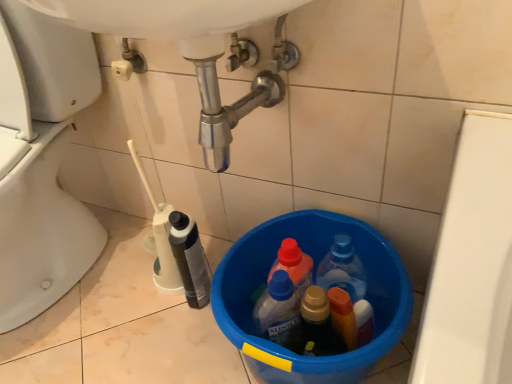
Image resolution: width=512 pixels, height=384 pixels. What do you see at coordinates (189, 259) in the screenshot?
I see `white plastic bottle at lower left` at bounding box center [189, 259].

This screenshot has height=384, width=512. Identify the location of white plastic bottle at lower left. (189, 259).

Between blue plastic bucket at lower center and white glossy toilet at lower left, which one is positioned behind?

Positioned behind is blue plastic bucket at lower center.

Which object is positioned more to the left, blue plastic bucket at lower center or white glossy toilet at lower left?

From the viewer's perspective, white glossy toilet at lower left appears more on the left side.

Is blue plastic bucket at lower center positioned with its back to white glossy toilet at lower left?

No.

Is blue plastic bucket at lower center next to white glossy toilet at lower left and touching it?

No, blue plastic bucket at lower center is not making contact with white glossy toilet at lower left.

From the image's perspective, which is below, white glossy toilet at lower left or white plastic bottle at lower left?

white plastic bottle at lower left appears lower in the image.

Which of these two, white glossy toilet at lower left or white plastic bottle at lower left, is smaller?

Smaller between the two is white plastic bottle at lower left.

Is white glossy toilet at lower left directly adjacent to white plastic bottle at lower left?

No, white glossy toilet at lower left is not with white plastic bottle at lower left.

From a real-world perspective, is white glossy toilet at lower left under white plastic bottle at lower left?

No, from a real-world perspective, white glossy toilet at lower left is not under white plastic bottle at lower left.

From their relative heights in the image, would you say white plastic bottle at lower left is taller or shorter than white glossy toilet at lower left?

Considering their sizes, white plastic bottle at lower left has less height than white glossy toilet at lower left.

In the scene shown: Is white plastic bottle at lower left outside of white glossy toilet at lower left?

That's correct, white plastic bottle at lower left is outside of white glossy toilet at lower left.

From a real-world perspective, does white plastic bottle at lower left stand above white glossy toilet at lower left?

No.

Which object is wider, blue plastic bucket at lower center or white plastic bottle at lower left?

Wider between the two is blue plastic bucket at lower center.

Is the position of blue plastic bucket at lower center less distant than that of white plastic bottle at lower left?

Yes, blue plastic bucket at lower center is in front of white plastic bottle at lower left.

Is blue plastic bucket at lower center taller than white plastic bottle at lower left?

No, blue plastic bucket at lower center is not taller than white plastic bottle at lower left.

Is blue plastic bucket at lower center positioned with its back to white plastic bottle at lower left?

blue plastic bucket at lower center does not have its back to white plastic bottle at lower left.

Considering the relative sizes of white glossy toilet at lower left and blue plastic bucket at lower center in the image provided, is white glossy toilet at lower left smaller than blue plastic bucket at lower center?

Incorrect, white glossy toilet at lower left is not smaller in size than blue plastic bucket at lower center.

How many degrees apart are the facing directions of white glossy toilet at lower left and blue plastic bucket at lower center?

white glossy toilet at lower left and blue plastic bucket at lower center are facing 0.00151 degrees away from each other.

From the image's perspective, is white glossy toilet at lower left over blue plastic bucket at lower center?

Yes, from the image's perspective, white glossy toilet at lower left is on top of blue plastic bucket at lower center.

Is white glossy toilet at lower left oriented away from blue plastic bucket at lower center?

white glossy toilet at lower left does not have its back to blue plastic bucket at lower center.

Is white plastic bottle at lower left turned away from blue plastic bucket at lower center?

No.

Who is taller, white plastic bottle at lower left or blue plastic bucket at lower center?

With more height is white plastic bottle at lower left.

Which is correct: white plastic bottle at lower left is inside blue plastic bucket at lower center, or outside of it?

white plastic bottle at lower left is located beyond the bounds of blue plastic bucket at lower center.

I want to click on toilet above the blue plastic bucket at lower center (from a real-world perspective), so click(41, 161).

This screenshot has height=384, width=512. I want to click on bottle below the white glossy toilet at lower left (from the image's perspective), so click(x=189, y=259).

From the image, which object appears to be farther from white glossy toilet at lower left, white plastic bottle at lower left or blue plastic bucket at lower center?

Among the two, blue plastic bucket at lower center is located further to white glossy toilet at lower left.

When comparing their distances from blue plastic bucket at lower center, does white glossy toilet at lower left or white plastic bottle at lower left seem further?

white glossy toilet at lower left lies further to blue plastic bucket at lower center than the other object.

Estimate the real-world distances between objects in this image. Which object is further from blue plastic bucket at lower center, white plastic bottle at lower left or white glossy toilet at lower left?

white glossy toilet at lower left lies further to blue plastic bucket at lower center than the other object.

Estimate the real-world distances between objects in this image. Which object is further from white glossy toilet at lower left, blue plastic bucket at lower center or white plastic bottle at lower left?

blue plastic bucket at lower center is positioned further to the anchor white glossy toilet at lower left.

In the scene shown: Looking at the image, which one is located further to white plastic bottle at lower left, white glossy toilet at lower left or blue plastic bucket at lower center?

white glossy toilet at lower left is further to white plastic bottle at lower left.

Looking at the image, which one is located further to white plastic bottle at lower left, blue plastic bucket at lower center or white glossy toilet at lower left?

white glossy toilet at lower left.

I want to click on bottle between white glossy toilet at lower left and blue plastic bucket at lower center from left to right, so click(189, 259).